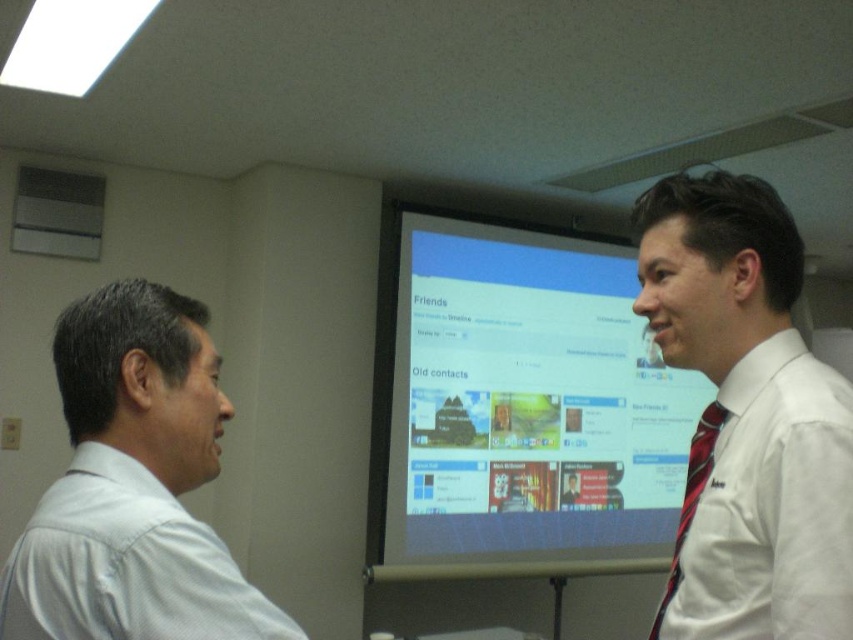
Question: Does matte plastic monitor at center lie in front of red striped tie at right?

Choices:
 (A) no
 (B) yes

Answer: (A)

Question: Which of the following is the farthest from the observer?

Choices:
 (A) light blue shirt at left
 (B) white shirt at center

Answer: (B)

Question: Can you confirm if white shirt at center is positioned below light blue shirt at left?

Choices:
 (A) no
 (B) yes

Answer: (A)

Question: Among these objects, which one is farthest from the camera?

Choices:
 (A) white shirt at center
 (B) matte plastic monitor at center
 (C) red striped tie at right

Answer: (B)

Question: Which object is farther from the camera taking this photo?

Choices:
 (A) red striped tie at right
 (B) white shirt at center
 (C) light blue shirt at left

Answer: (A)

Question: Is white shirt at center closer to the viewer compared to light blue shirt at left?

Choices:
 (A) yes
 (B) no

Answer: (B)